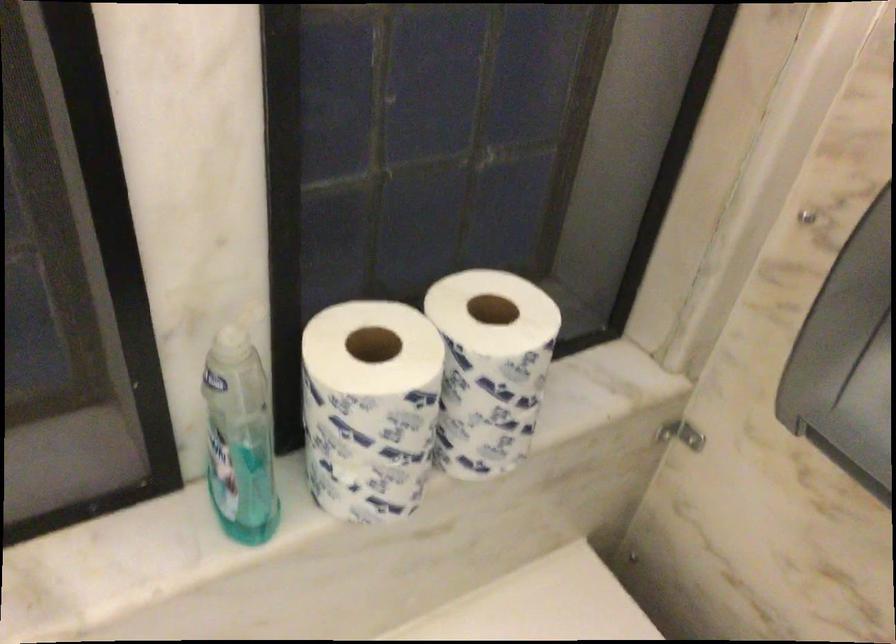
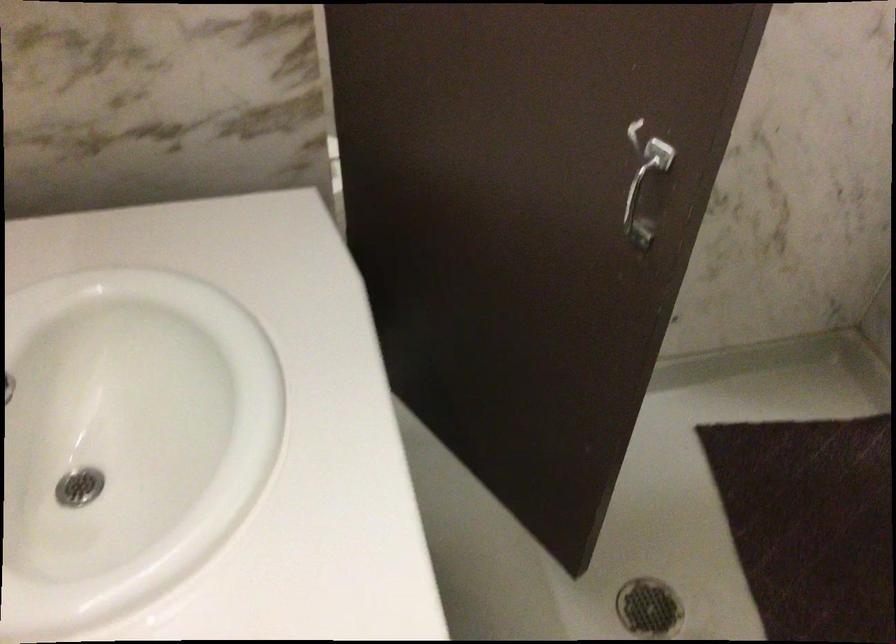
How did the camera likely rotate?

The camera's rotation is toward right-down.